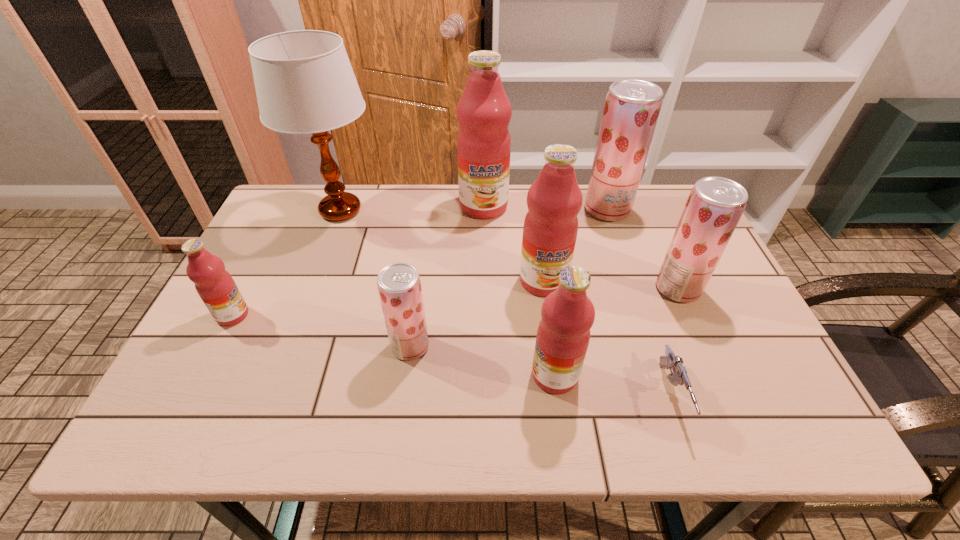
This screenshot has height=540, width=960. I want to click on free space between the shortest object and the third smallest pink fruit juice, so click(608, 338).

The image size is (960, 540). In order to click on free space between the third smallest pink fruit juice and the brown table lamp in this screenshot , I will do `click(442, 246)`.

At what (x,y) coordinates should I click in order to perform the action: click on empty space between the third nearest pink fruit juice and the seventh object from right to left. Please return your answer as a coordinate pair (x, y). Looking at the image, I should click on (477, 314).

Identify which object is located as the fourth nearest to the sixth fruit juice from right to left. Please provide its 2D coordinates. Your answer should be formatted as a tuple, i.e. [(x, y)], where the tuple contains the x and y coordinates of a point satisfying the conditions above.

[(215, 286)]

Select which object is the seventh closest to the leftmost fruit juice. Please provide its 2D coordinates. Your answer should be formatted as a tuple, i.e. [(x, y)], where the tuple contains the x and y coordinates of a point satisfying the conditions above.

[(679, 376)]

Choose which fruit juice is the fourth nearest neighbor to the farthest strawberry fruit juice. Please provide its 2D coordinates. Your answer should be formatted as a tuple, i.e. [(x, y)], where the tuple contains the x and y coordinates of a point satisfying the conditions above.

[(567, 314)]

Where is `fruit juice that is the fifth nearest to the third biggest pink fruit juice`? The height and width of the screenshot is (540, 960). fruit juice that is the fifth nearest to the third biggest pink fruit juice is located at coordinates (484, 111).

Locate an element on the screen. Image resolution: width=960 pixels, height=540 pixels. pink fruit juice that stands as the second closest to the second smallest pink fruit juice is located at coordinates (484, 111).

The image size is (960, 540). What are the coordinates of `pink fruit juice identified as the third closest to the farthest strawberry fruit juice` in the screenshot? It's located at (567, 314).

The height and width of the screenshot is (540, 960). In order to click on strawberry fruit juice object that ranks as the second closest to the third fruit juice from left to right in this screenshot , I will do `click(399, 286)`.